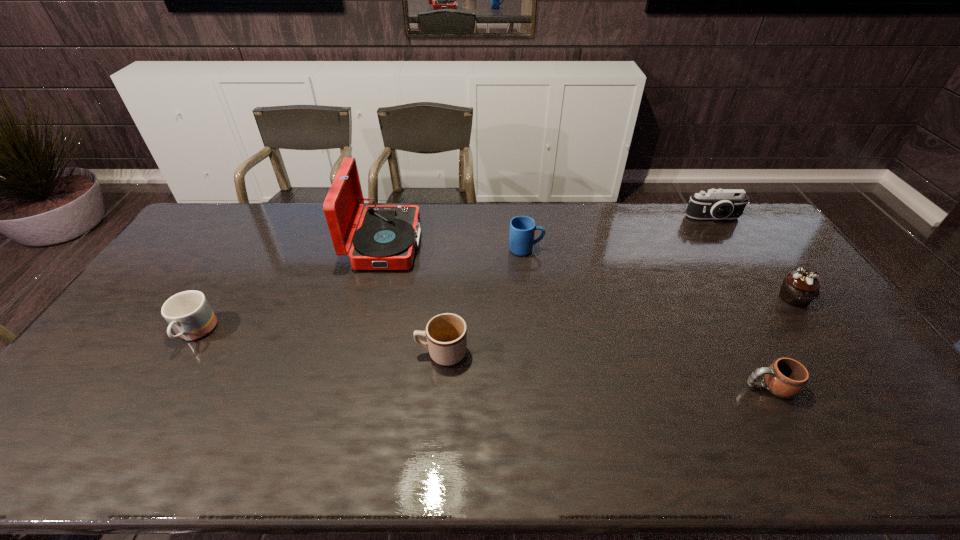
Image resolution: width=960 pixels, height=540 pixels. Identify the location of vacant point located 0.290m on the front-facing side of the second object from left to right. (502, 244).

Identify the location of blank area located 0.390m on the front lens of the camera. 768,301.

Locate an element on the screen. Image resolution: width=960 pixels, height=540 pixels. free space located on the side of the second mug from right to left with the handle is located at coordinates (621, 249).

At what (x,y) coordinates should I click in order to perform the action: click on vacant space situated on the side of the second mug from left to right with the handle. Please return your answer as a coordinate pair (x, y). This screenshot has height=540, width=960. Looking at the image, I should click on (376, 353).

The image size is (960, 540). I want to click on vacant space located on the side of the second mug from left to right with the handle, so click(x=391, y=353).

Identify the location of free spot located 0.380m on the side of the second mug from left to right with the handle. The width and height of the screenshot is (960, 540). (277, 353).

Locate an element on the screen. Image resolution: width=960 pixels, height=540 pixels. free spot located 0.350m on the front of the fourth farthest object is located at coordinates (878, 416).

The image size is (960, 540). Find the location of `vacant area situated 0.300m on the side with the handle of the leftmost mug`. vacant area situated 0.300m on the side with the handle of the leftmost mug is located at coordinates (116, 463).

Where is `free space located 0.290m on the side of the shortest object with the handle`? The width and height of the screenshot is (960, 540). free space located 0.290m on the side of the shortest object with the handle is located at coordinates (631, 387).

Locate an element on the screen. blank space located 0.190m on the side of the shortest object with the handle is located at coordinates (670, 387).